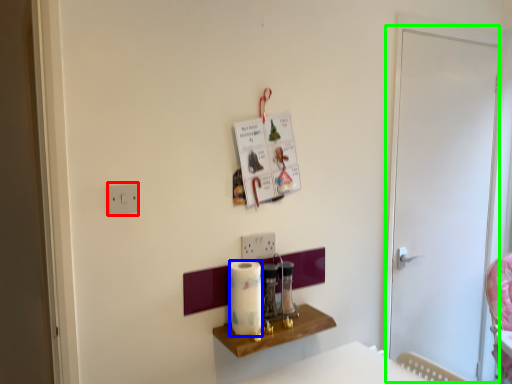
Question: Which object is the closest to the light switch (highlighted by a red box)? Choose among these: paper towel (highlighted by a blue box) or screen door (highlighted by a green box).

Choices:
 (A) paper towel
 (B) screen door

Answer: (A)